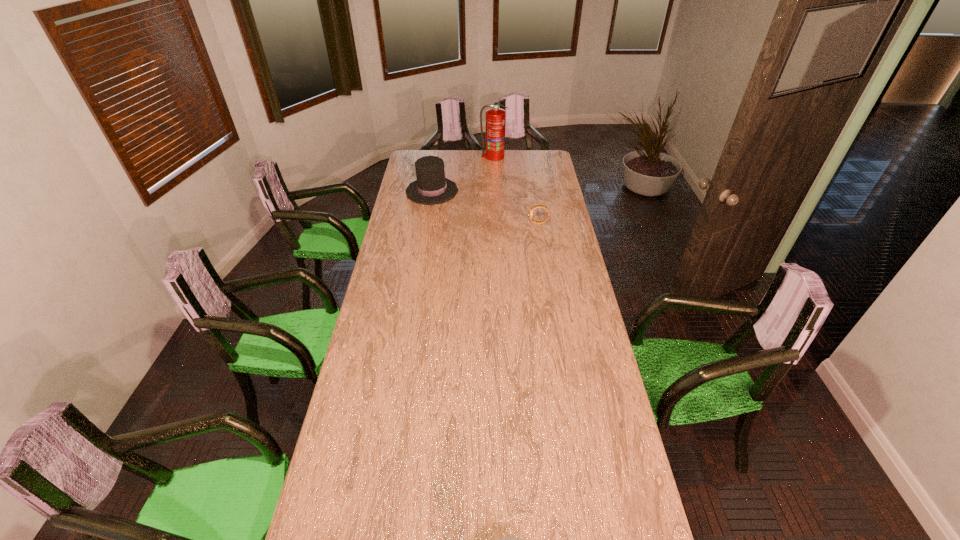
The width and height of the screenshot is (960, 540). What are the coordinates of `vacant space situated 0.320m on the face of the third farthest object` in the screenshot? It's located at (467, 223).

Locate an element on the screen. The width and height of the screenshot is (960, 540). object that is at the far edge is located at coordinates (494, 148).

Image resolution: width=960 pixels, height=540 pixels. Identify the location of object positioned at the left edge. (431, 187).

Image resolution: width=960 pixels, height=540 pixels. Identify the location of object at the right edge. (536, 206).

Where is `vacant area at the left edge`? This screenshot has height=540, width=960. vacant area at the left edge is located at coordinates (378, 281).

Identify the location of vacant region at the right edge of the desktop. (563, 356).

Identify the location of vacant space at the far left corner of the desktop. This screenshot has height=540, width=960. (419, 157).

You are a GUI agent. You are given a task and a screenshot of the screen. Output one action in this format:
    pyautogui.click(x=<x>, y=<y>)
    Task: Click on the vacant space at the far right corner of the desktop
    
    Given the screenshot: What is the action you would take?
    pyautogui.click(x=538, y=160)

At what (x,y) coordinates should I click in order to perform the action: click on unoccupied area between the tallest object and the dress hat. Please return your answer as a coordinate pair (x, y). The image size is (960, 540). Looking at the image, I should click on (463, 174).

The height and width of the screenshot is (540, 960). Find the location of `free space that is in between the rightmost object and the fire extinguisher`. free space that is in between the rightmost object and the fire extinguisher is located at coordinates (516, 190).